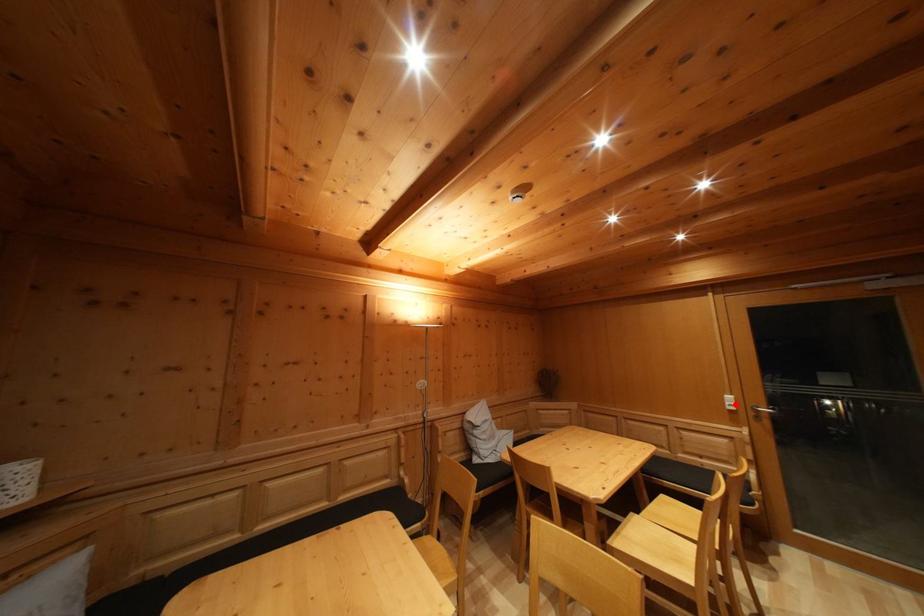
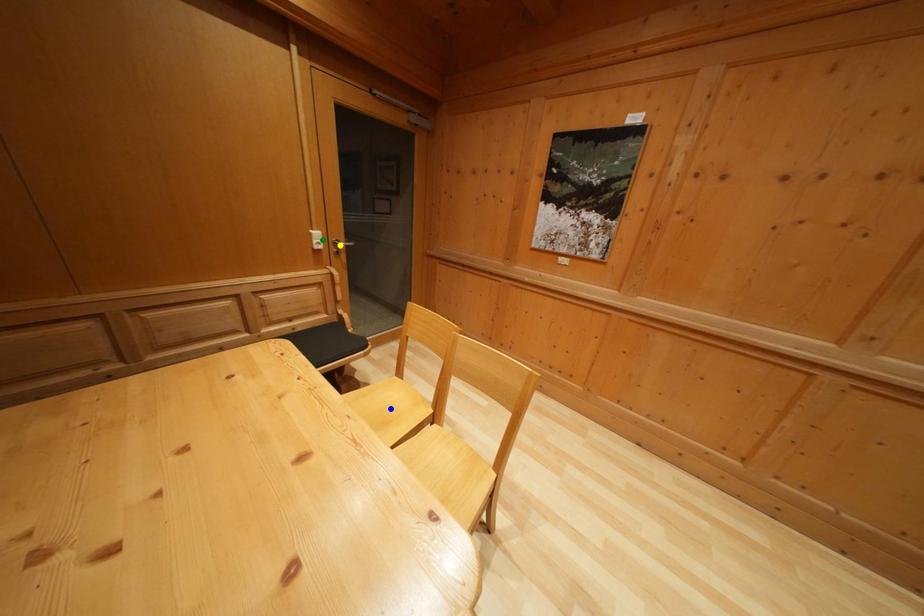
Question: I am providing you with two images of the same scene from different viewpoints. A red point is marked on the first image. You are given multiple points on the second image. Which point in image 2 is actually the same real-world point as the red point in image 1?

Choices:
 (A) blue point
 (B) green point
 (C) yellow point

Answer: (B)